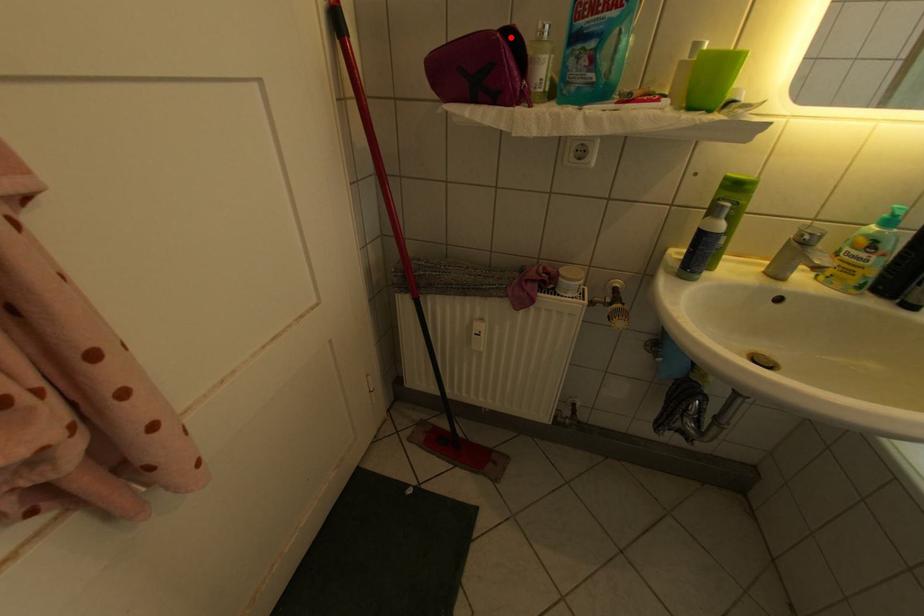
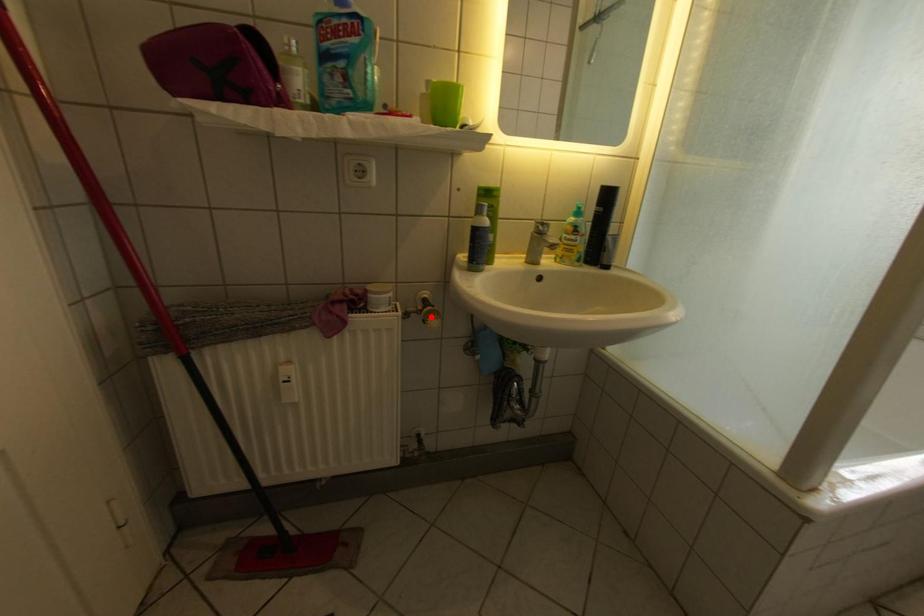
I am providing you with two images of the same scene from different viewpoints. A red point is marked on the first image and another point is marked on the second image. Are the points marked in image1 and image2 representing the same 3D position?

No